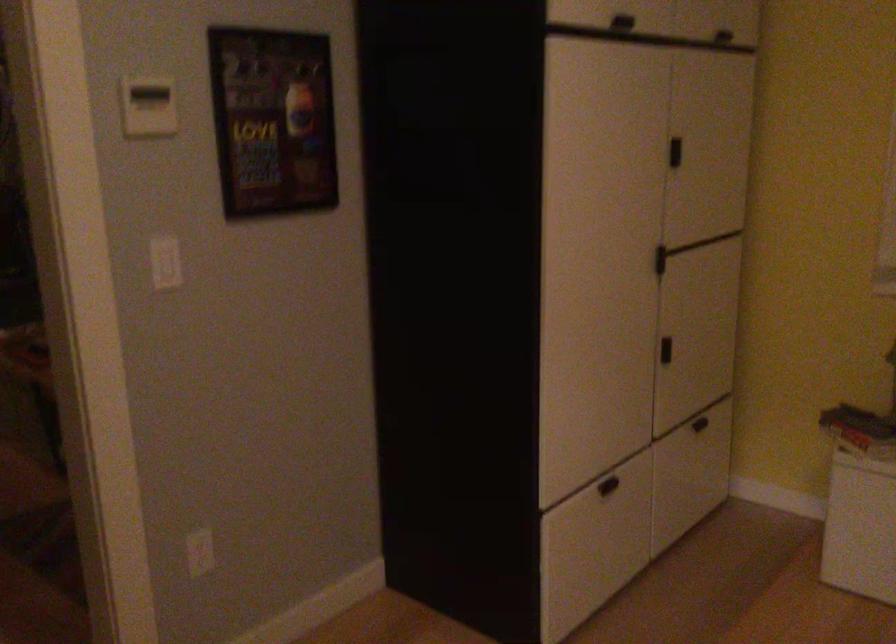
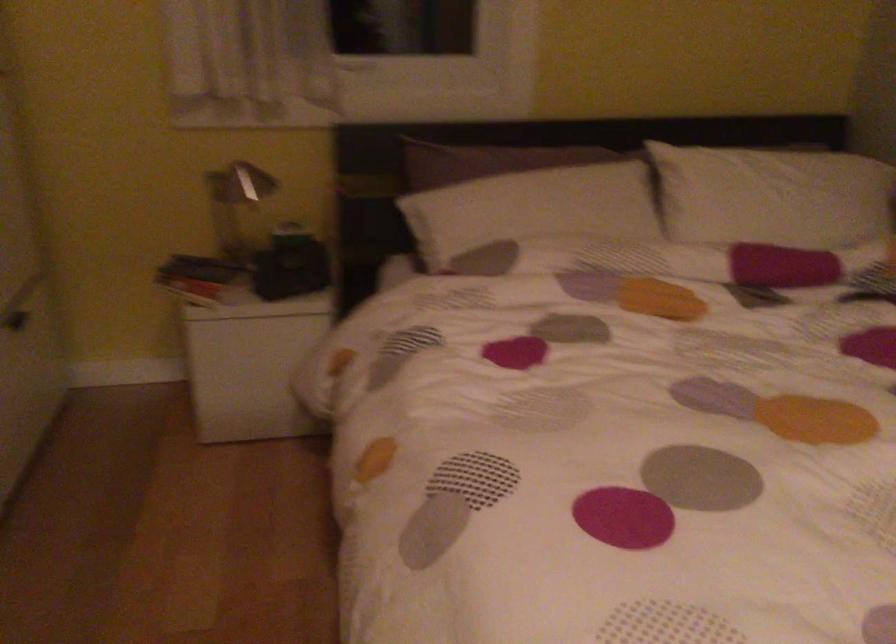
Question: The first image is from the beginning of the video and the second image is from the end. How did the camera likely rotate when shooting the video?

Choices:
 (A) Left
 (B) Right
 (C) Up
 (D) Down

Answer: (B)